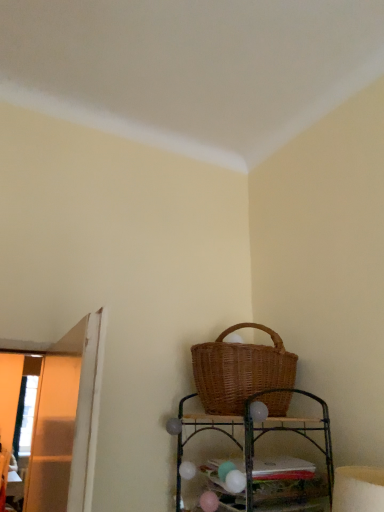
What is the approximate height of woven wood shelf at lower center?

woven wood shelf at lower center is 38.14 centimeters in height.

This screenshot has width=384, height=512. I want to click on woven wood shelf at lower center, so click(266, 460).

Measure the distance between woven wood shelf at lower center and camera.

They are 4.04 feet apart.

This screenshot has width=384, height=512. Describe the element at coordinates (266, 460) in the screenshot. I see `woven wood shelf at lower center` at that location.

What do you see at coordinates (240, 370) in the screenshot? This screenshot has height=512, width=384. I see `woven brown picnic basket at upper right` at bounding box center [240, 370].

You are a GUI agent. You are given a task and a screenshot of the screen. Output one action in this format:
    pyautogui.click(x=<x>, y=<y>)
    Task: Click on the woven brown picnic basket at upper right
    The width and height of the screenshot is (384, 512).
    Given the screenshot: What is the action you would take?
    pyautogui.click(x=240, y=370)

Locate an element on the screen. This screenshot has width=384, height=512. woven wood shelf at lower center is located at coordinates (266, 460).

Considering the relative positions of woven wood shelf at lower center and woven brown picnic basket at upper right in the image provided, is woven wood shelf at lower center to the left of woven brown picnic basket at upper right from the viewer's perspective?

Yes.

In the scene shown: Relative to woven brown picnic basket at upper right, is woven wood shelf at lower center in front or behind?

Visually, woven wood shelf at lower center is located in front of woven brown picnic basket at upper right.

Does point (183, 398) come behind point (262, 359)?

Yes, point (183, 398) is farther from viewer.

From the image's perspective, does woven wood shelf at lower center appear higher than woven brown picnic basket at upper right?

No, from the image's perspective, woven wood shelf at lower center is not over woven brown picnic basket at upper right.

From a real-world perspective, who is located lower, woven wood shelf at lower center or woven brown picnic basket at upper right?

In real-world perspective, woven wood shelf at lower center is lower.

Can you confirm if woven wood shelf at lower center is wider than woven brown picnic basket at upper right?

No.

Who is shorter, woven wood shelf at lower center or woven brown picnic basket at upper right?

With less height is woven brown picnic basket at upper right.

Considering the sizes of objects woven wood shelf at lower center and woven brown picnic basket at upper right in the image provided, who is smaller, woven wood shelf at lower center or woven brown picnic basket at upper right?

With smaller size is woven wood shelf at lower center.

Is woven brown picnic basket at upper right surrounded by woven wood shelf at lower center?

No, woven brown picnic basket at upper right is not inside woven wood shelf at lower center.

Is woven wood shelf at lower center beside woven brown picnic basket at upper right?

No, woven wood shelf at lower center is not in contact with woven brown picnic basket at upper right.

Is woven wood shelf at lower center facing towards woven brown picnic basket at upper right?

No, woven wood shelf at lower center is not turned towards woven brown picnic basket at upper right.

I want to click on shelf below the woven brown picnic basket at upper right (from the image's perspective), so click(266, 460).

Is woven brown picnic basket at upper right to the left of woven wood shelf at lower center from the viewer's perspective?

No.

Is woven brown picnic basket at upper right further to the viewer compared to woven wood shelf at lower center?

Yes.

Does point (278, 405) come farther from viewer compared to point (280, 429)?

Yes, it is.

Looking at this image, from the image's perspective, between woven brown picnic basket at upper right and woven wood shelf at lower center, which one is located above?

woven brown picnic basket at upper right.

From a real-world perspective, is woven brown picnic basket at upper right positioned above or below woven wood shelf at lower center?

Clearly, from a real-world perspective, woven brown picnic basket at upper right is above woven wood shelf at lower center.

Is woven brown picnic basket at upper right wider or thinner than woven wood shelf at lower center?

woven brown picnic basket at upper right is wider than woven wood shelf at lower center.

Is woven brown picnic basket at upper right shorter than woven wood shelf at lower center?

Correct, woven brown picnic basket at upper right is not as tall as woven wood shelf at lower center.

Does woven brown picnic basket at upper right have a larger size compared to woven wood shelf at lower center?

Indeed, woven brown picnic basket at upper right has a larger size compared to woven wood shelf at lower center.

Is woven brown picnic basket at upper right outside of woven wood shelf at lower center?

Indeed, woven brown picnic basket at upper right is completely outside woven wood shelf at lower center.

From the picture: Is the surface of woven brown picnic basket at upper right in direct contact with woven wood shelf at lower center?

No, woven brown picnic basket at upper right is not in contact with woven wood shelf at lower center.

Is woven brown picnic basket at upper right positioned with its back to woven wood shelf at lower center?

No, woven wood shelf at lower center is not at the back of woven brown picnic basket at upper right.

You are a GUI agent. You are given a task and a screenshot of the screen. Output one action in this format:
    pyautogui.click(x=<x>, y=<y>)
    Task: Click on the shelf that is in front of the woven brown picnic basket at upper right
    
    Given the screenshot: What is the action you would take?
    pyautogui.click(x=266, y=460)

The width and height of the screenshot is (384, 512). Find the location of `picnic basket behind the woven wood shelf at lower center`. picnic basket behind the woven wood shelf at lower center is located at coordinates (240, 370).

The height and width of the screenshot is (512, 384). I want to click on picnic basket on the right of woven wood shelf at lower center, so click(240, 370).